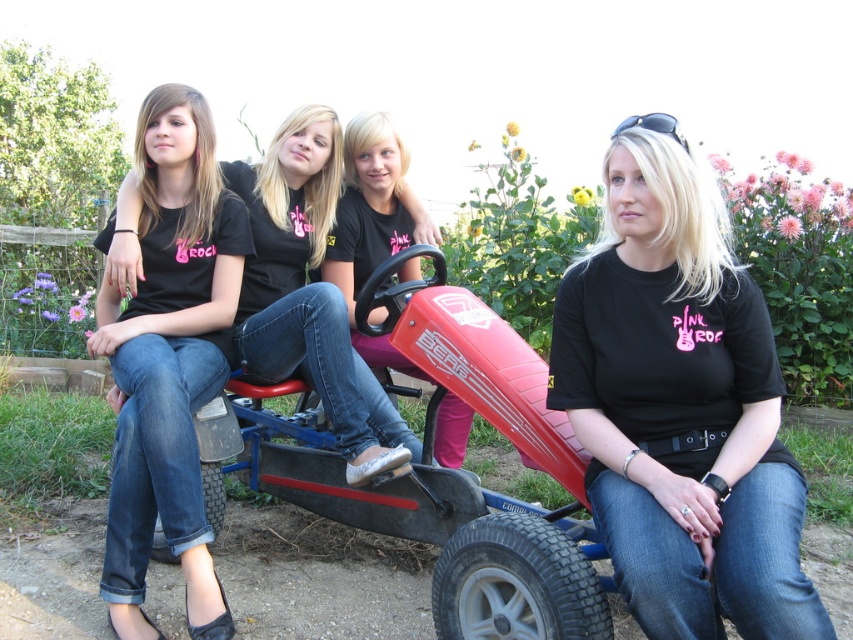
Is black matte t-shirt at center taller than matte black shirt at left?

No, black matte t-shirt at center is not taller than matte black shirt at left.

Does black matte t-shirt at center have a larger size compared to matte black shirt at left?

Actually, black matte t-shirt at center might be smaller than matte black shirt at left.

What do you see at coordinates (680, 404) in the screenshot? Image resolution: width=853 pixels, height=640 pixels. I see `black matte t-shirt at center` at bounding box center [680, 404].

Locate an element on the screen. The width and height of the screenshot is (853, 640). black matte t-shirt at center is located at coordinates (680, 404).

Consider the image. Is black matte t-shirt at center wider than metallic red go-kart at center?

No.

Between black matte t-shirt at center and metallic red go-kart at center, which one is positioned higher?

black matte t-shirt at center

Is point (642, 128) positioned in front of point (303, 461)?

Yes, point (642, 128) is closer to viewer.

The width and height of the screenshot is (853, 640). Find the location of `black matte t-shirt at center`. black matte t-shirt at center is located at coordinates (680, 404).

Between metallic red go-kart at center and matte black t-shirt at center, which one appears on the left side from the viewer's perspective?

Positioned to the left is matte black t-shirt at center.

Is point (560, 618) closer to camera compared to point (318, 220)?

Yes, point (560, 618) is closer to viewer.

Is point (405, 525) in front of point (381, 449)?

No.

Find the location of a particular element. The height and width of the screenshot is (640, 853). metallic red go-kart at center is located at coordinates (438, 468).